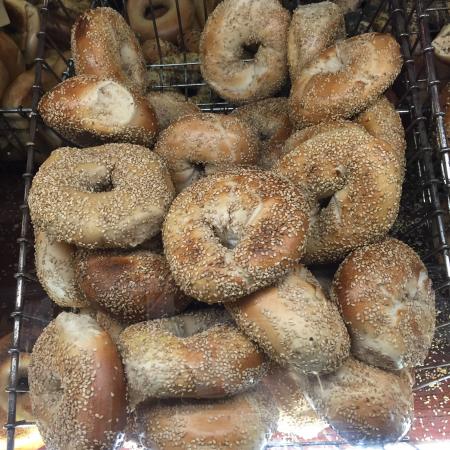
Where is `wooden table`? The height and width of the screenshot is (450, 450). wooden table is located at coordinates (16, 238), (6, 309), (415, 416), (436, 411), (442, 353).